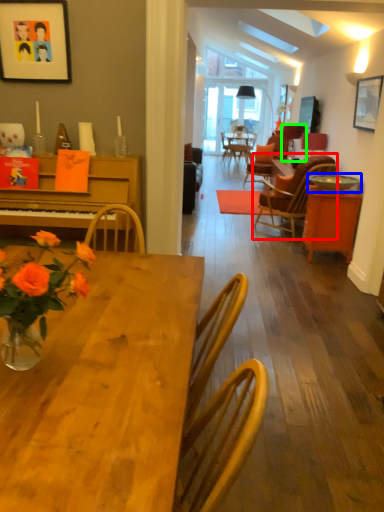
Question: Which object is positioned farthest from chair (highlighted by a red box)? Select from bowl (highlighted by a blue box) and lamp (highlighted by a green box).

Choices:
 (A) bowl
 (B) lamp

Answer: (A)